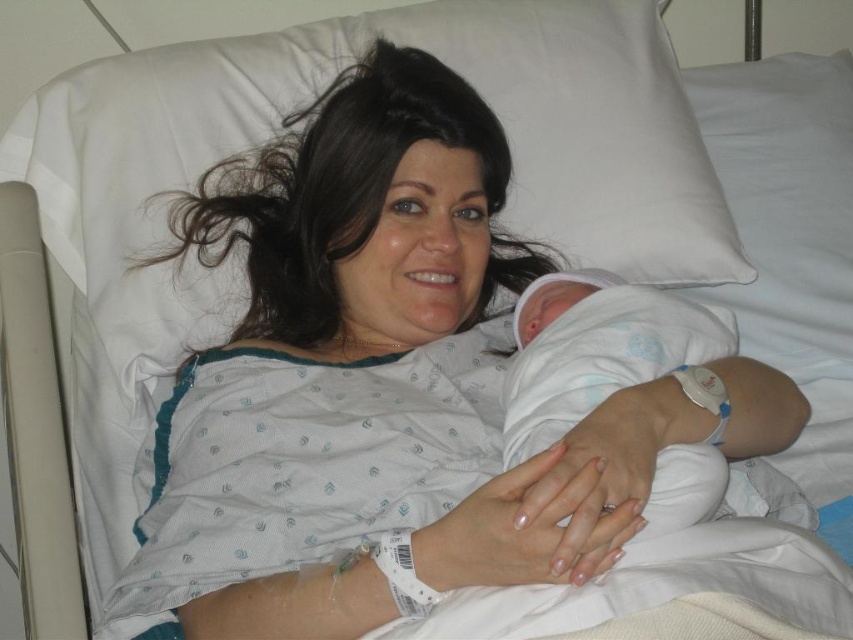
You are a nurse checking the hospital room. There is a point at coordinate (785, 204). What object is this point located on?

The point at coordinate (785, 204) is located on the white fabric pillow at upper right.

You are a nurse in a hospital room. You need to place a small medical kit between the white fabric pillow at upper right and the white soft cloth at center. The medical kit is 12 inches long. Will it fit in the space between them?

The white fabric pillow at upper right and white soft cloth at center are 15.38 inches apart. Since the medical kit is 12 inches long, it will fit in the space between them as 12 inches is less than 15.38 inches.